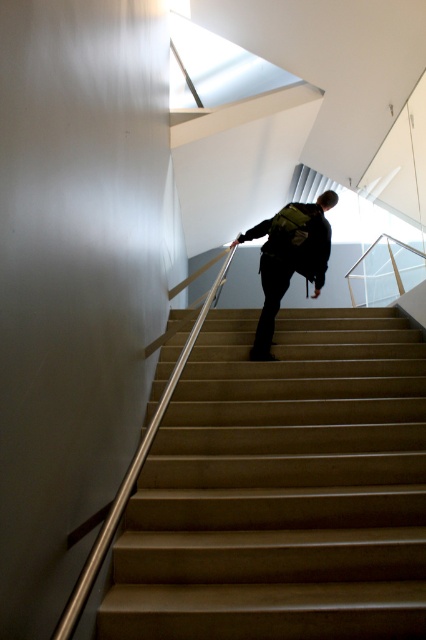
You are a delivery person carrying a package and need to place it on the smooth beige stairs at center. However, you notice the black matte backpack at center is already there. Can you place your package on the stairs without moving the backpack?

The smooth beige stairs at center is below the black matte backpack at center, meaning the backpack is placed on top of the stairs. Therefore, there is space below the backpack on the stairs to place your package without moving it.

You are a delivery robot with a width of 0.8 meters. You need to navigate up the smooth beige stairs at center while carrying a package that is as wide as the black matte backpack at center. Can you safely ascend the stairs without getting stuck?

The smooth beige stairs at center might be wider than the black matte backpack at center. Since the package is as wide as the backpack, and the stairs are possibly wider, the robot can likely ascend safely, but there is uncertainty due to the comparative width not being definitively confirmed.

You are a delivery person carrying a package and need to walk up the smooth beige stairs at center while avoiding the black matte backpack at center. Which side should you walk on to go up the stairs?

The smooth beige stairs at center is positioned on the right side of black matte backpack at center, so you should walk on the left side to go up the stairs while avoiding the backpack.